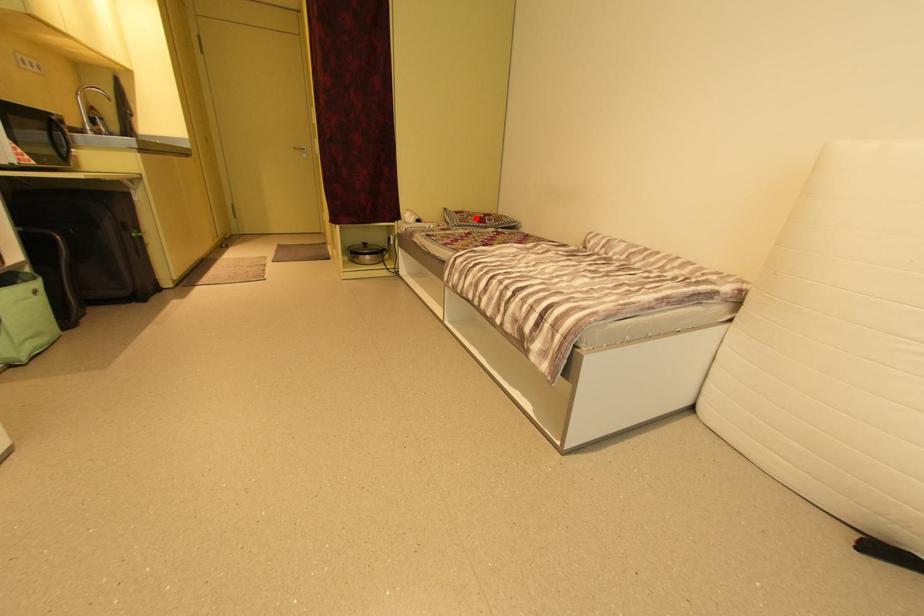
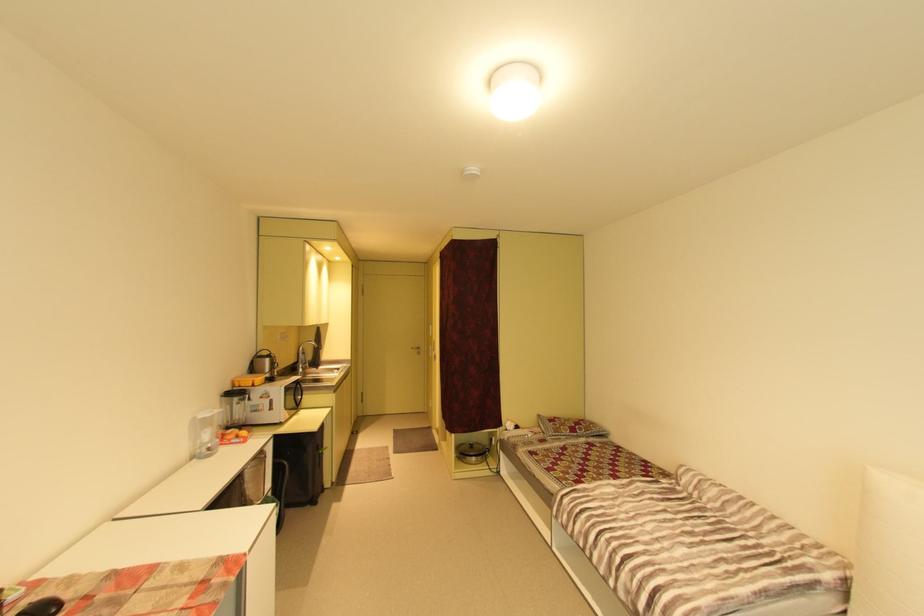
Where in the second image is the point corresponding to the highlighted location from the first image?

(568, 428)